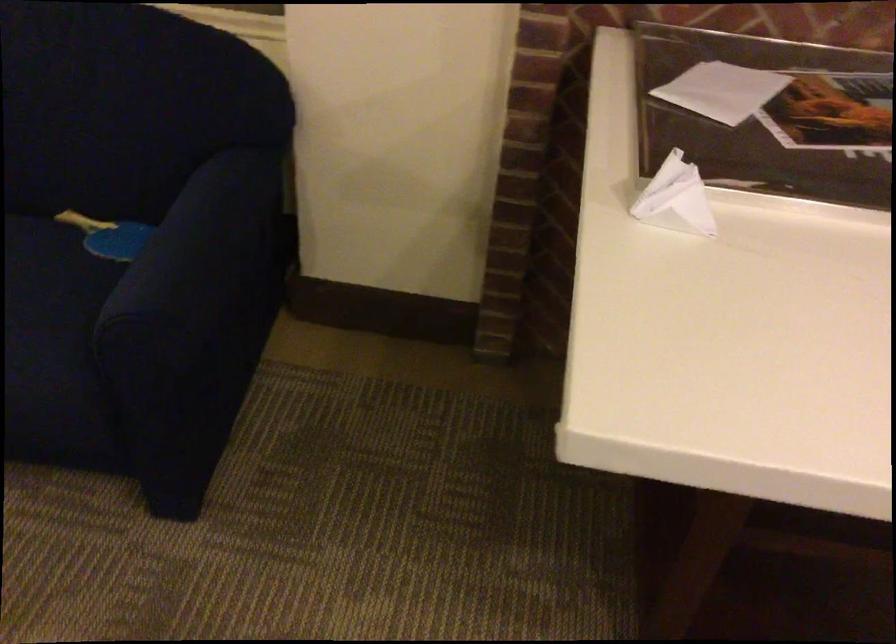
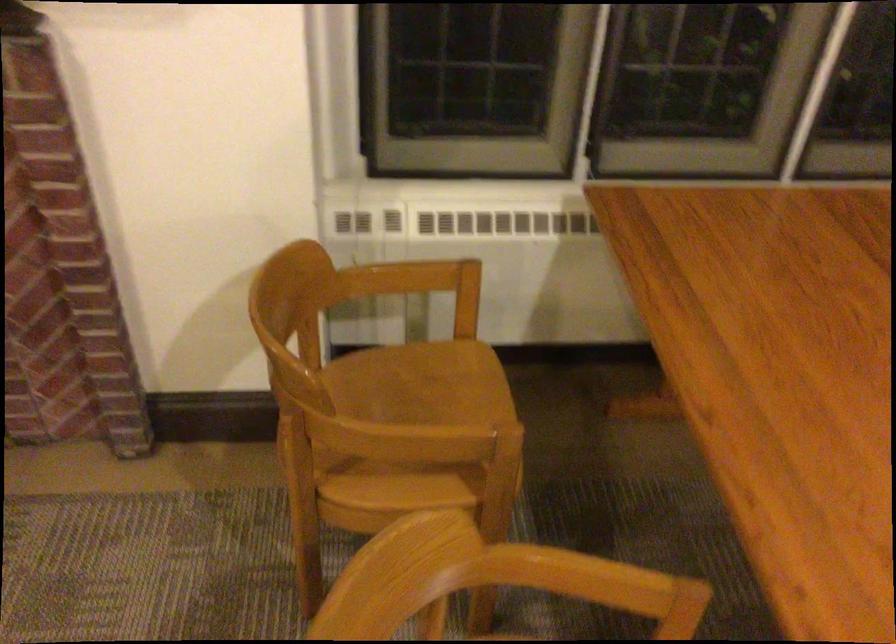
Question: In a continuous first-person perspective shot, in which direction is the camera moving?

Choices:
 (A) Left
 (B) Right
 (C) Forward
 (D) Backward

Answer: (B)